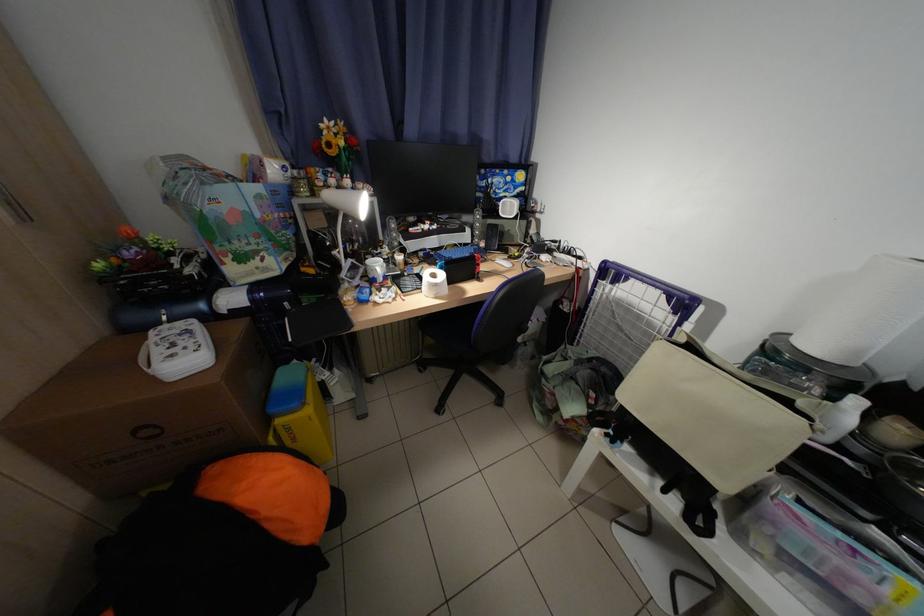
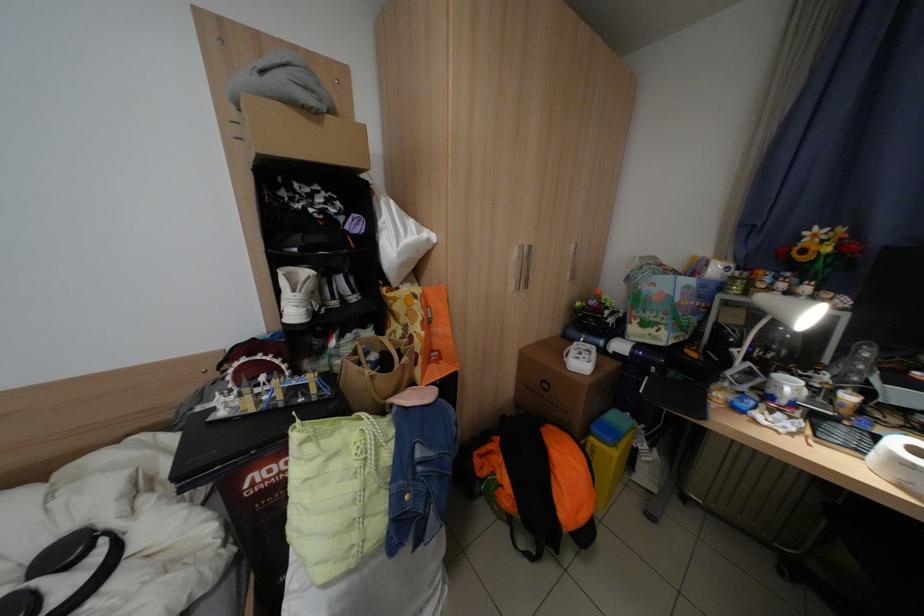
In the second image, find the point that corresponds to point 157,434 in the first image.

(555, 387)